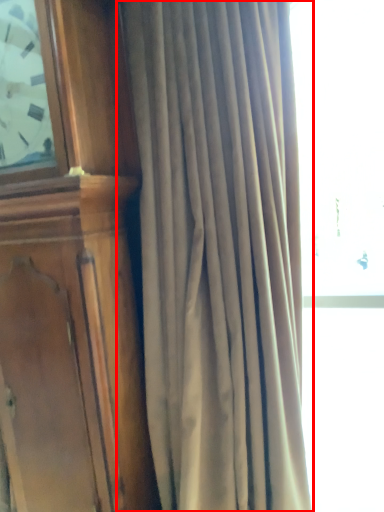
Question: From the image's perspective, considering the relative positions of curtain (annotated by the red box) and furniture in the image provided, where is curtain (annotated by the red box) located with respect to the staircase?

Choices:
 (A) above
 (B) below

Answer: (B)